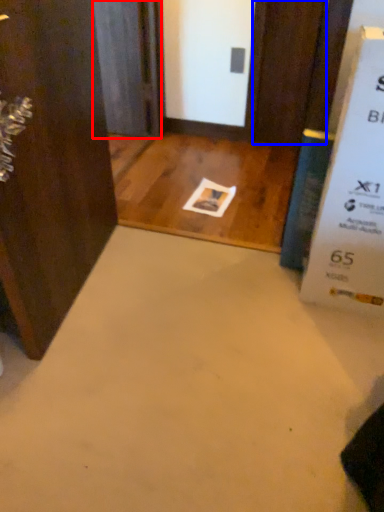
Question: Among these objects, which one is nearest to the camera, screen door (highlighted by a red box) or door (highlighted by a blue box)?

Choices:
 (A) screen door
 (B) door

Answer: (B)